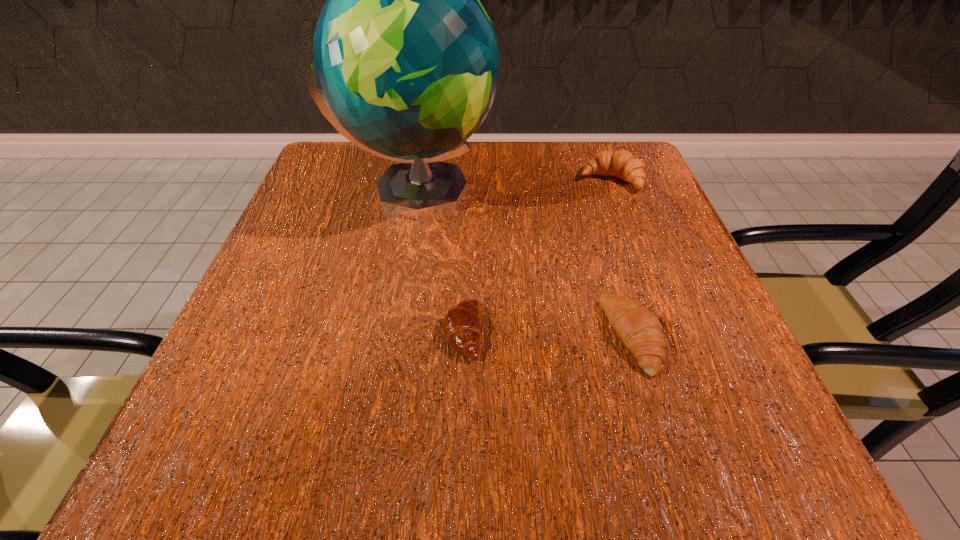
I want to click on blank region between the second shortest crescent roll and the tallest object, so click(525, 265).

At what (x,y) coordinates should I click in order to perform the action: click on vacant point located between the second shortest crescent roll and the tallest object. Please return your answer as a coordinate pair (x, y). The height and width of the screenshot is (540, 960). Looking at the image, I should click on (525, 265).

Find the location of a particular element. This screenshot has height=540, width=960. object that stands as the third closest to the second shortest object is located at coordinates (622, 164).

Select which object appears as the third closest to the second tallest crescent roll. Please provide its 2D coordinates. Your answer should be formatted as a tuple, i.e. [(x, y)], where the tuple contains the x and y coordinates of a point satisfying the conditions above.

[(622, 164)]

Image resolution: width=960 pixels, height=540 pixels. Find the location of `crescent roll that stands as the second closest to the second tallest crescent roll`. crescent roll that stands as the second closest to the second tallest crescent roll is located at coordinates (622, 164).

Locate an element on the screen. The height and width of the screenshot is (540, 960). the third closest crescent roll to the globe is located at coordinates (641, 331).

This screenshot has width=960, height=540. I want to click on vacant space that satisfies the following two spatial constraints: 1. on the back side of the second tallest object; 2. on the right side of the second shortest object, so [x=587, y=180].

Find the location of a particular element. vacant region that satisfies the following two spatial constraints: 1. on the back side of the second shortest object; 2. on the front surface of the globe is located at coordinates (591, 193).

The width and height of the screenshot is (960, 540). I want to click on free spot that satisfies the following two spatial constraints: 1. on the front side of the shortest crescent roll; 2. on the right side of the second shortest crescent roll, so click(x=463, y=337).

Locate an element on the screen. free space that satisfies the following two spatial constraints: 1. on the front surface of the leftmost crescent roll; 2. on the left side of the tallest object is located at coordinates (391, 333).